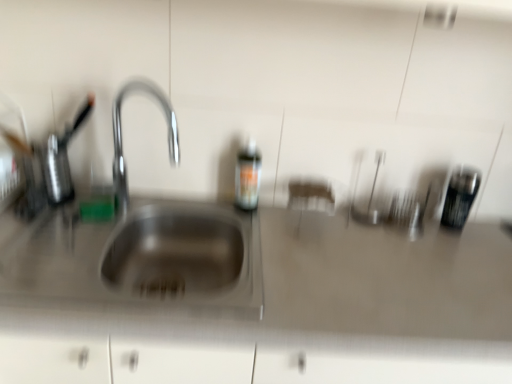
Measure the distance between point (250, 169) and camera.

Answer: Point (250, 169) is 4.12 feet away from camera.

The image size is (512, 384). What do you see at coordinates (259, 277) in the screenshot?
I see `satin steel sink at center` at bounding box center [259, 277].

In order to click on stainless steel sink at left in this screenshot , I will do `click(134, 243)`.

Is metallic black canister at right bigger than translucent plastic bottle at center?

Correct, metallic black canister at right is larger in size than translucent plastic bottle at center.

Could translucent plastic bottle at center be considered to be inside metallic black canister at right?

No, translucent plastic bottle at center is not surrounded by metallic black canister at right.

Between point (450, 206) and point (248, 208), which one is positioned in front?

The point (248, 208) is more forward.

How much distance is there between metallic black canister at right and translucent plastic bottle at center?

They are 25.26 inches apart.

Is translucent plastic bottle at center oriented away from satin steel sink at center?

That's not correct — translucent plastic bottle at center is not looking away from satin steel sink at center.

How different are the orientations of translucent plastic bottle at center and satin steel sink at center in degrees?

The angle between the facing direction of translucent plastic bottle at center and the facing direction of satin steel sink at center is 0.318 degrees.

Based on their sizes in the image, would you say translucent plastic bottle at center is bigger or smaller than satin steel sink at center?

translucent plastic bottle at center is smaller than satin steel sink at center.

Considering the positions of point (246, 175) and point (133, 315), is point (246, 175) closer or farther from the camera than point (133, 315)?

Point (246, 175).

Which is behind, point (238, 182) or point (461, 180)?

Positioned behind is point (461, 180).

From a real-world perspective, is translucent plastic bottle at center above or below metallic black canister at right?

translucent plastic bottle at center is situated higher than metallic black canister at right in the real world.

Based on their positions, is translucent plastic bottle at center located to the left or right of metallic black canister at right?

In the image, translucent plastic bottle at center appears on the left side of metallic black canister at right.

Consider the image. Between translucent plastic bottle at center and metallic black canister at right, which one has smaller size?

translucent plastic bottle at center.

Based on the photo, from the image's perspective, is stainless steel sink at left located above translucent plastic bottle at center?

No, from the image's perspective, stainless steel sink at left is not over translucent plastic bottle at center.

Is stainless steel sink at left far from translucent plastic bottle at center?

No, stainless steel sink at left is in close proximity to translucent plastic bottle at center.

Does stainless steel sink at left have a lesser width compared to translucent plastic bottle at center?

In fact, stainless steel sink at left might be wider than translucent plastic bottle at center.

Consider the image. Considering the relative sizes of stainless steel sink at left and translucent plastic bottle at center in the image provided, is stainless steel sink at left smaller than translucent plastic bottle at center?

No, stainless steel sink at left is not smaller than translucent plastic bottle at center.

Does metallic black canister at right have a greater height compared to stainless steel sink at left?

No.

Considering the positions of objects metallic black canister at right and stainless steel sink at left in the image provided, who is in front, metallic black canister at right or stainless steel sink at left?

stainless steel sink at left is more forward.

Is metallic black canister at right not within stainless steel sink at left?

metallic black canister at right is positioned outside stainless steel sink at left.

From the image's perspective, between metallic black canister at right and stainless steel sink at left, which one is located above?

metallic black canister at right.

Is point (242, 185) positioned before point (170, 157)?

Yes.

Can you confirm if translucent plastic bottle at center is positioned to the left of stainless steel sink at left?

No.

Measure the distance between translucent plastic bottle at center and stainless steel sink at left.

translucent plastic bottle at center and stainless steel sink at left are 12.91 inches apart from each other.

Considering the relative sizes of translucent plastic bottle at center and stainless steel sink at left in the image provided, is translucent plastic bottle at center taller than stainless steel sink at left?

No.

Based on the photo, from the image's perspective, is satin steel sink at center located beneath metallic black canister at right?

Yes, from the image's perspective, satin steel sink at center is below metallic black canister at right.

Considering the relative sizes of satin steel sink at center and metallic black canister at right in the image provided, is satin steel sink at center thinner than metallic black canister at right?

No, satin steel sink at center is not thinner than metallic black canister at right.

Which is closer to the camera, (267,254) or (462,217)?

Positioned in front is point (267,254).

Where is `appliance located above the satin steel sink at center (from a real-world perspective)`? appliance located above the satin steel sink at center (from a real-world perspective) is located at coordinates (460, 197).

This screenshot has width=512, height=384. In order to click on bottle above the metallic black canister at right (from a real-world perspective) in this screenshot , I will do `click(248, 176)`.

The width and height of the screenshot is (512, 384). Find the location of `counter top on the right of translucent plastic bottle at center`. counter top on the right of translucent plastic bottle at center is located at coordinates (259, 277).

Which object lies further to the anchor point stainless steel sink at left, satin steel sink at center or metallic black canister at right?

The object further to stainless steel sink at left is metallic black canister at right.

From the image, which object appears to be nearer to metallic black canister at right, stainless steel sink at left or translucent plastic bottle at center?

translucent plastic bottle at center is closer to metallic black canister at right.

Considering their positions, is stainless steel sink at left positioned closer to satin steel sink at center than metallic black canister at right?

stainless steel sink at left lies closer to satin steel sink at center than the other object.

Which object lies nearer to the anchor point translucent plastic bottle at center, stainless steel sink at left or metallic black canister at right?

stainless steel sink at left is closer to translucent plastic bottle at center.

Based on their spatial positions, is metallic black canister at right or satin steel sink at center closer to stainless steel sink at left?

satin steel sink at center.

From the picture: Looking at the image, which one is located closer to metallic black canister at right, stainless steel sink at left or satin steel sink at center?

Based on the image, satin steel sink at center appears to be nearer to metallic black canister at right.

Estimate the real-world distances between objects in this image. Which object is further from metallic black canister at right, translucent plastic bottle at center or satin steel sink at center?

translucent plastic bottle at center is further to metallic black canister at right.

Looking at the image, which one is located closer to stainless steel sink at left, translucent plastic bottle at center or satin steel sink at center?

satin steel sink at center is closer to stainless steel sink at left.

This screenshot has height=384, width=512. Find the location of `bottle located between stainless steel sink at left and metallic black canister at right in the left-right direction`. bottle located between stainless steel sink at left and metallic black canister at right in the left-right direction is located at coordinates coord(248,176).

The image size is (512, 384). Find the location of `counter top situated between translucent plastic bottle at center and metallic black canister at right from left to right`. counter top situated between translucent plastic bottle at center and metallic black canister at right from left to right is located at coordinates (259, 277).

Where is `counter top situated between stainless steel sink at left and metallic black canister at right from left to right`? The width and height of the screenshot is (512, 384). counter top situated between stainless steel sink at left and metallic black canister at right from left to right is located at coordinates (259, 277).

Identify the location of sink between translucent plastic bottle at center and satin steel sink at center in the up-down direction. (134, 243).